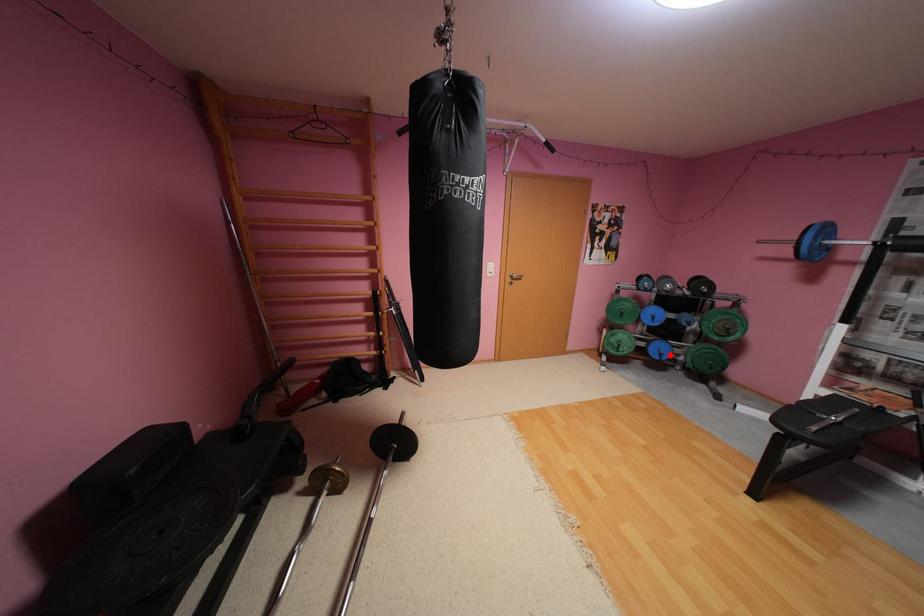
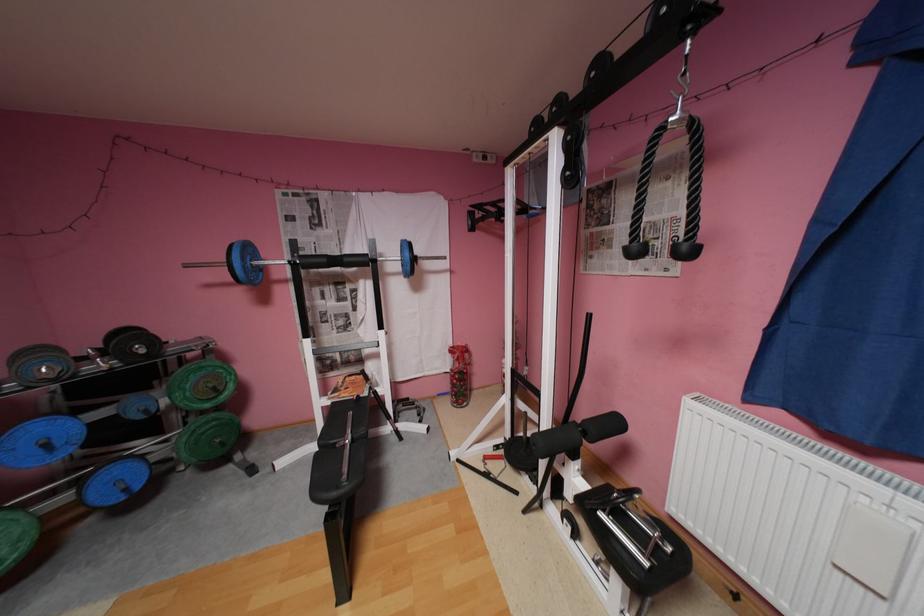
Find the pixel in the second image that matches the highlighted location in the first image.

(134, 488)